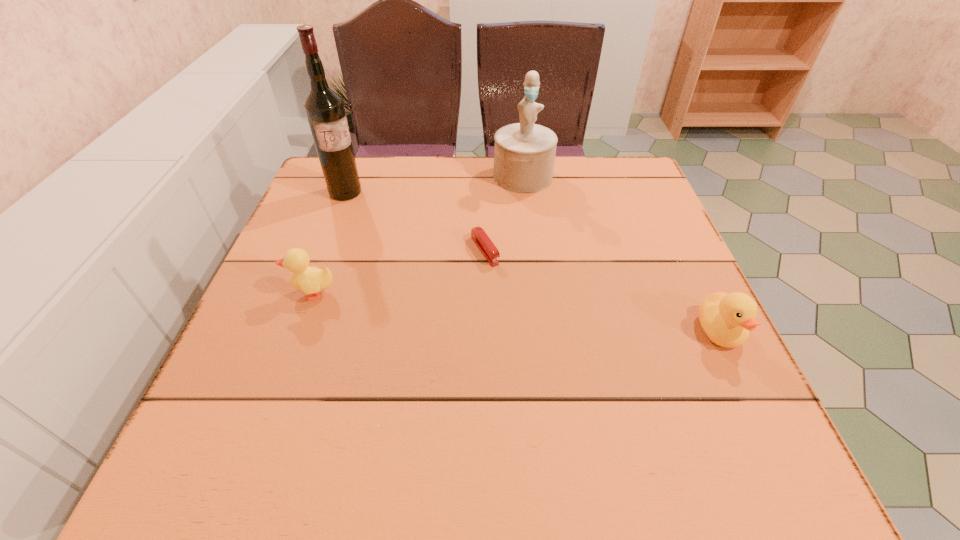
At what (x,y) coordinates should I click in order to perform the action: click on the left duckling. Please return your answer as a coordinate pair (x, y). The height and width of the screenshot is (540, 960). Looking at the image, I should click on (309, 280).

You are a GUI agent. You are given a task and a screenshot of the screen. Output one action in this format:
    pyautogui.click(x=<x>, y=<y>)
    Task: Click on the farther duckling
    This screenshot has height=540, width=960.
    Given the screenshot: What is the action you would take?
    pyautogui.click(x=309, y=280)

In order to click on the nearest object in this screenshot , I will do `click(726, 319)`.

At what (x,y) coordinates should I click in order to perform the action: click on the right duckling. Please return your answer as a coordinate pair (x, y). The height and width of the screenshot is (540, 960). Looking at the image, I should click on (726, 319).

What are the coordinates of `the third nearest object` in the screenshot? It's located at (483, 242).

Find the location of a particular element. the shortest object is located at coordinates (483, 242).

The image size is (960, 540). In order to click on wine bottle in this screenshot , I will do `click(324, 108)`.

What are the coordinates of `the fourth shortest object` in the screenshot? It's located at (524, 153).

Find the location of a particular element. The width and height of the screenshot is (960, 540). vacant space situated on the front-facing side of the third farthest object is located at coordinates (516, 300).

Identify the location of free space located on the front-facing side of the third farthest object. (547, 345).